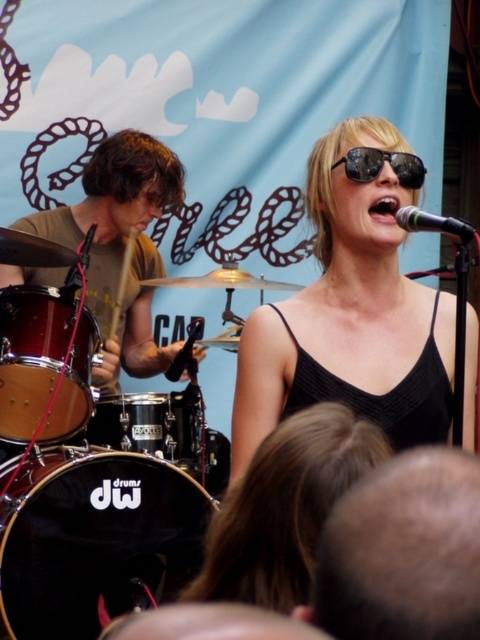
Is brown cotton shirt at left wider than black reflective sunglasses at center?

Correct, the width of brown cotton shirt at left exceeds that of black reflective sunglasses at center.

Measure the distance from brown cotton shirt at left to black reflective sunglasses at center.

brown cotton shirt at left and black reflective sunglasses at center are 1.53 meters apart.

I want to click on brown cotton shirt at left, so click(x=120, y=243).

Is shiny silver drum at center bigger than black metallic microphone at upper center?

Correct, shiny silver drum at center is larger in size than black metallic microphone at upper center.

Measure the distance between shiny silver drum at center and black metallic microphone at upper center.

They are 5.20 feet apart.

Is point (131, 422) positioned before point (421, 228)?

No, (131, 422) is further to viewer.

I want to click on shiny silver drum at center, so click(149, 424).

Between black mesh tank top at upper center and shiny silver drum at center, which one has less height?

shiny silver drum at center

Is black mesh tank top at upper center to the right of shiny silver drum at center from the viewer's perspective?

Indeed, black mesh tank top at upper center is positioned on the right side of shiny silver drum at center.

Where is `black mesh tank top at upper center`? The height and width of the screenshot is (640, 480). black mesh tank top at upper center is located at coordinates (350, 314).